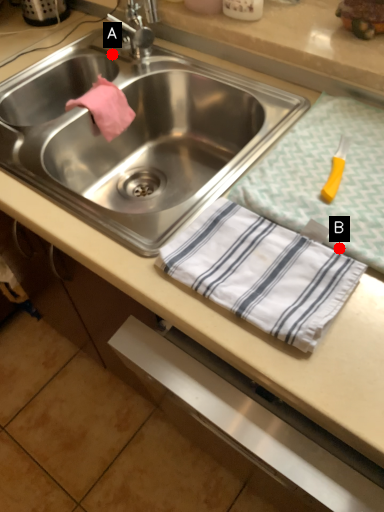
Question: Two points are circled on the image, labeled by A and B beside each circle. Which point is closer to the camera?

Choices:
 (A) A is closer
 (B) B is closer

Answer: (B)